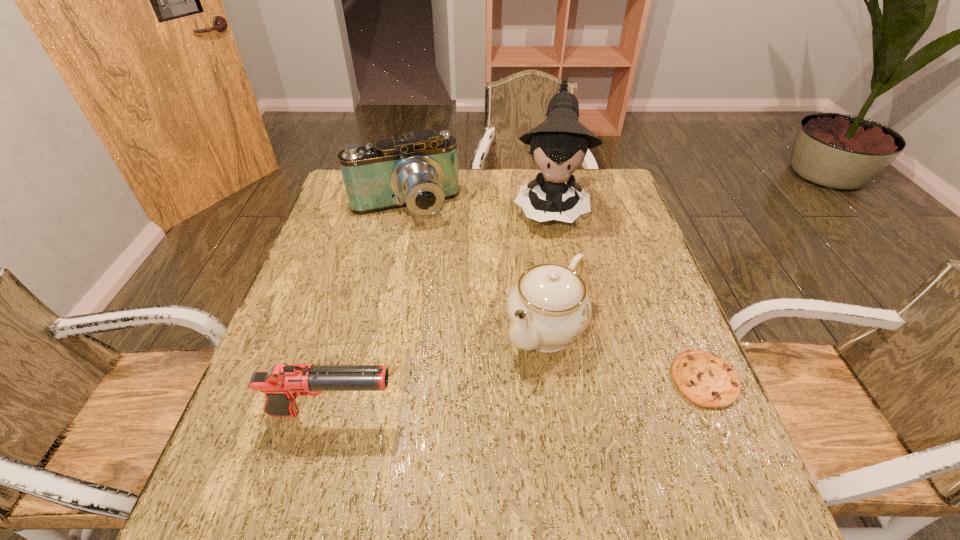
At what (x,y) coordinates should I click in order to perform the action: click on vacant space on the desktop that is between the fourth tallest object and the shortest object and is positioned at the face of the doll. Please return your answer as a coordinate pair (x, y). The height and width of the screenshot is (540, 960). Looking at the image, I should click on (542, 394).

This screenshot has height=540, width=960. I want to click on vacant space on the desktop that is between the second shortest object and the cookie and is positioned at the spout of the chinaware, so 484,399.

Locate an element on the screen. The width and height of the screenshot is (960, 540). free spot on the desktop that is between the second shortest object and the shortest object and is positioned on the front-facing side of the camcorder is located at coordinates (470, 401).